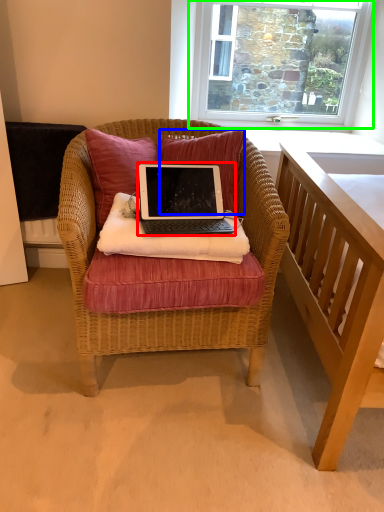
Question: Based on their relative distances, which object is nearer to laptop (highlighted by a red box)? Choose from pillow (highlighted by a blue box) and window (highlighted by a green box).

Choices:
 (A) pillow
 (B) window

Answer: (A)